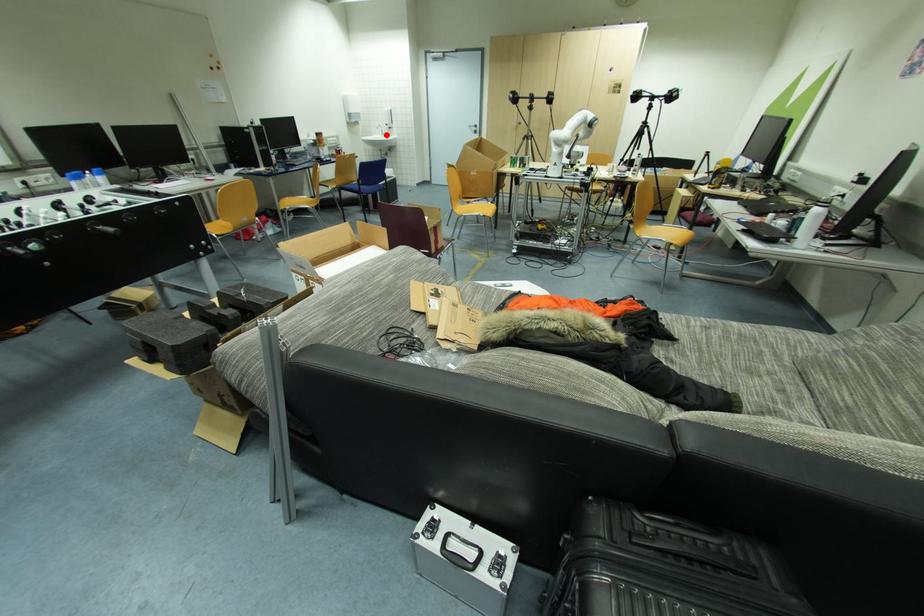
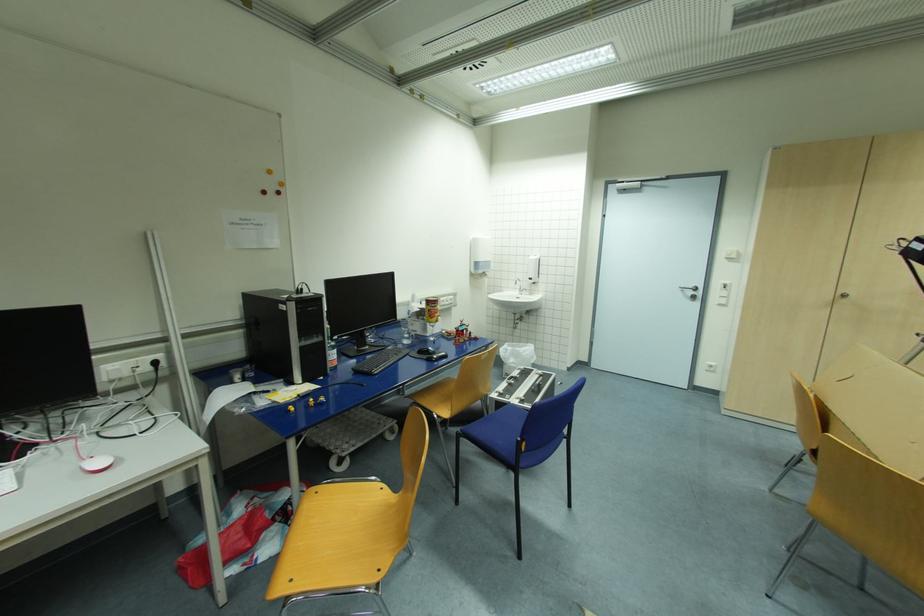
Question: A red point is marked in image1. In image2, is the corresponding 3D point closer to the camera or farther? Reply with the corresponding letter.

Choices:
 (A) The corresponding 3D point is closer.
 (B) The corresponding 3D point is farther.

Answer: (B)